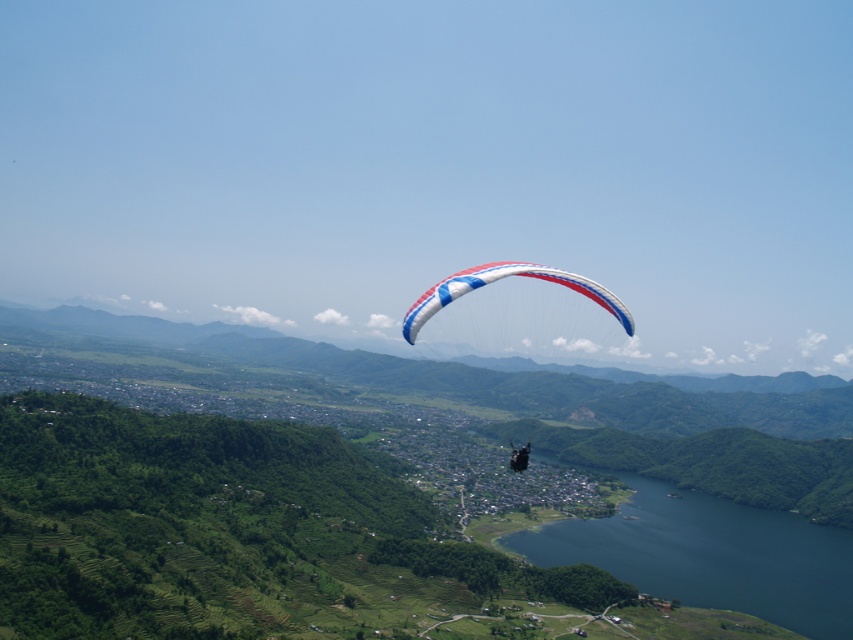
You are a photographer planning to capture a landscape shot that includes both the blue glossy water at lower center and the white and blue fabric parachute at center. Based on their relative heights, which object should appear closer to the top of the photo?

The white and blue fabric parachute at center should appear closer to the top of the photo because it has a greater height compared to the blue glossy water at lower center.

You are a photographer taking an aerial shot of the landscape. You notice two parachutes in the scene. Which parachute is positioned closer to your camera lens? Please choose between the white fabric parachute at center and the white and blue fabric parachute at center.

The white fabric parachute at center is closer to the viewer than the white and blue fabric parachute at center, so the white fabric parachute at center would appear closer to your camera lens.

You are a drone operator trying to capture the paraglider and the blue glossy water at lower center in the same frame. The drone can only capture objects within a 400 meter distance. Can you capture both in the same frame?

The paraglider and the blue glossy water at lower center are 360.79 meters apart. Since the drone can capture objects within 400 meters, they can be captured in the same frame.